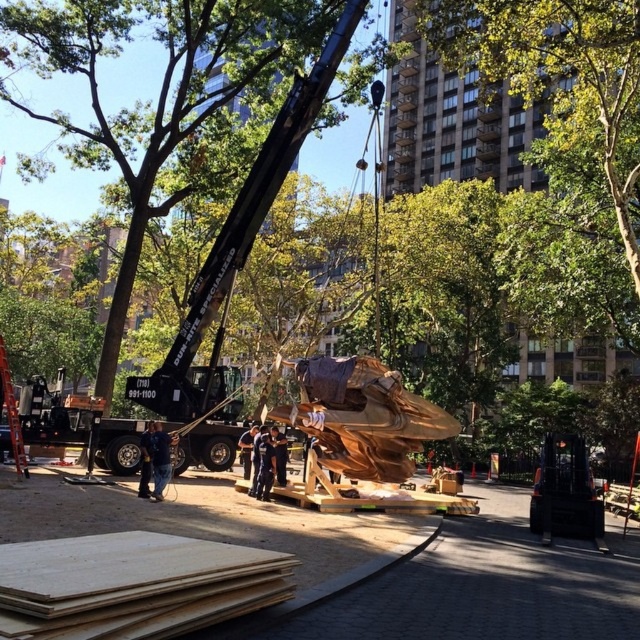
Which of these two, green leafy tree at center or blue denim jeans at lower left, stands taller?

With more height is green leafy tree at center.

Find the location of a particular element. green leafy tree at center is located at coordinates (161, 88).

Is wooden boards at center taller than green leafy tree at center?

Incorrect, wooden boards at center's height is not larger of green leafy tree at center's.

The width and height of the screenshot is (640, 640). Describe the element at coordinates (481, 586) in the screenshot. I see `wooden boards at center` at that location.

Where is `wooden boards at center`? wooden boards at center is located at coordinates (481, 586).

Can you confirm if golden polished wood sculpture at center is positioned to the left of blue denim jeans at lower left?

In fact, golden polished wood sculpture at center is to the right of blue denim jeans at lower left.

Who is shorter, golden polished wood sculpture at center or blue denim jeans at lower left?

blue denim jeans at lower left

Where is `golden polished wood sculpture at center`? Image resolution: width=640 pixels, height=640 pixels. golden polished wood sculpture at center is located at coordinates pos(364,417).